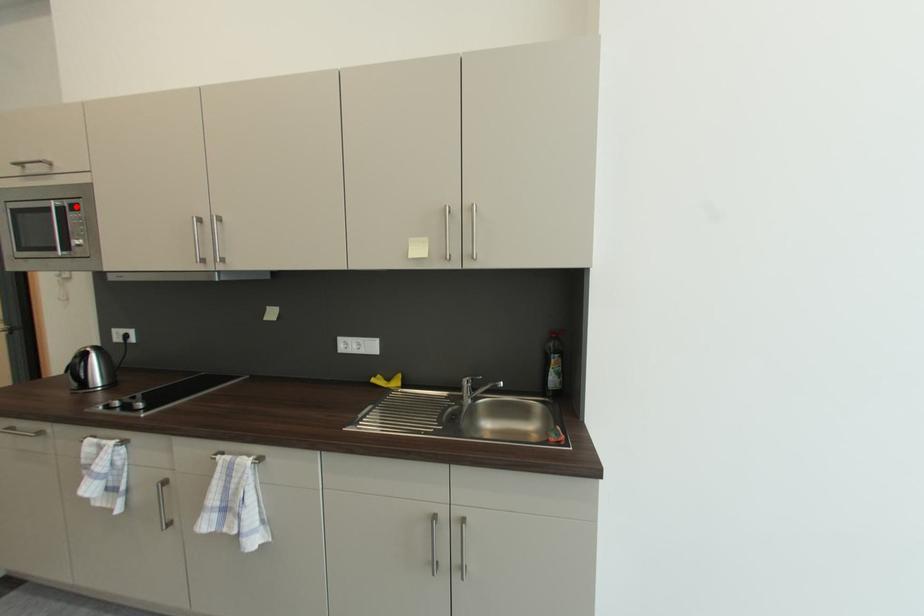
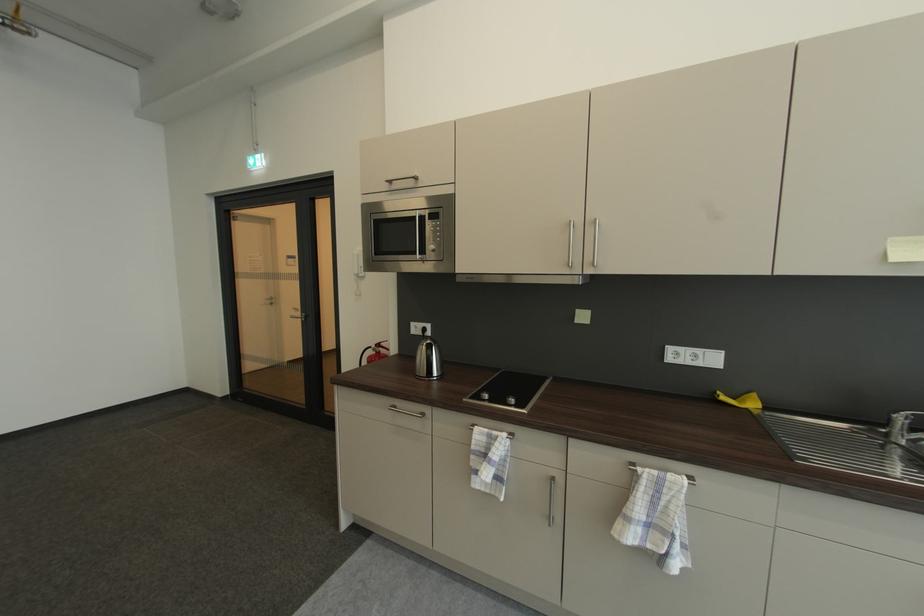
Question: A red point is marked in image1. In image2, is the corresponding 3D point closer to the camera or farther? Reply with the corresponding letter.

Choices:
 (A) The corresponding 3D point is closer.
 (B) The corresponding 3D point is farther.

Answer: (A)